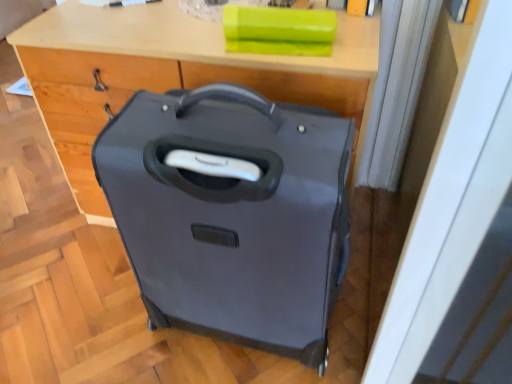
You are a GUI agent. You are given a task and a screenshot of the screen. Output one action in this format:
    pyautogui.click(x=<x>, y=<y>)
    Task: Click on the free space above matte wood computer desk at center (from a real-world perspective)
    Image resolution: width=512 pixels, height=384 pixels.
    Given the screenshot: What is the action you would take?
    pyautogui.click(x=186, y=19)